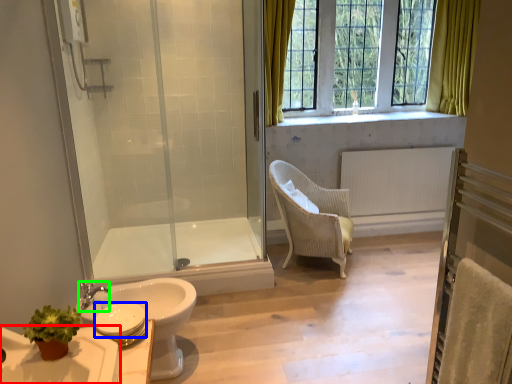
Question: Which is nearer to the sink (highlighted by a red box)? toilet paper (highlighted by a blue box) or faucet (highlighted by a green box).

Choices:
 (A) toilet paper
 (B) faucet

Answer: (A)